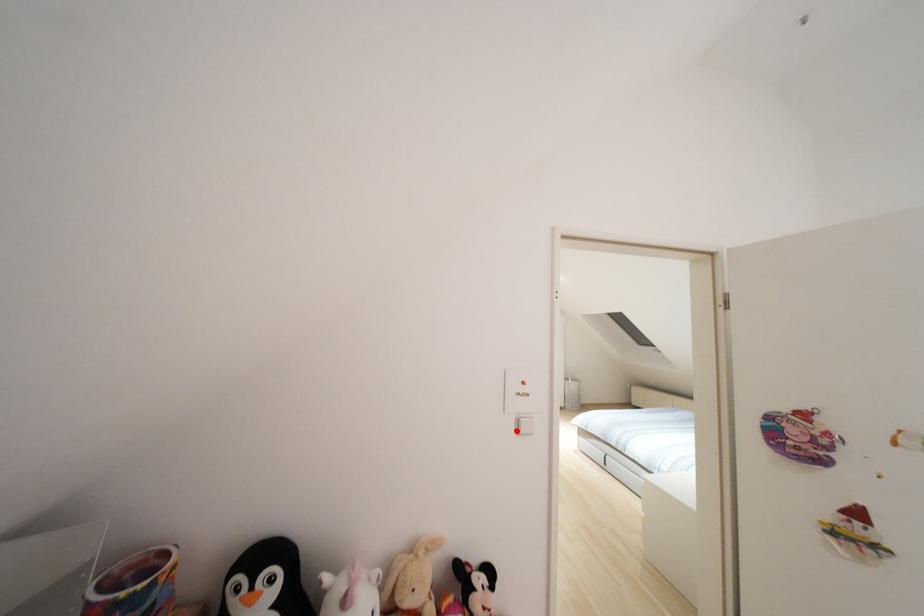
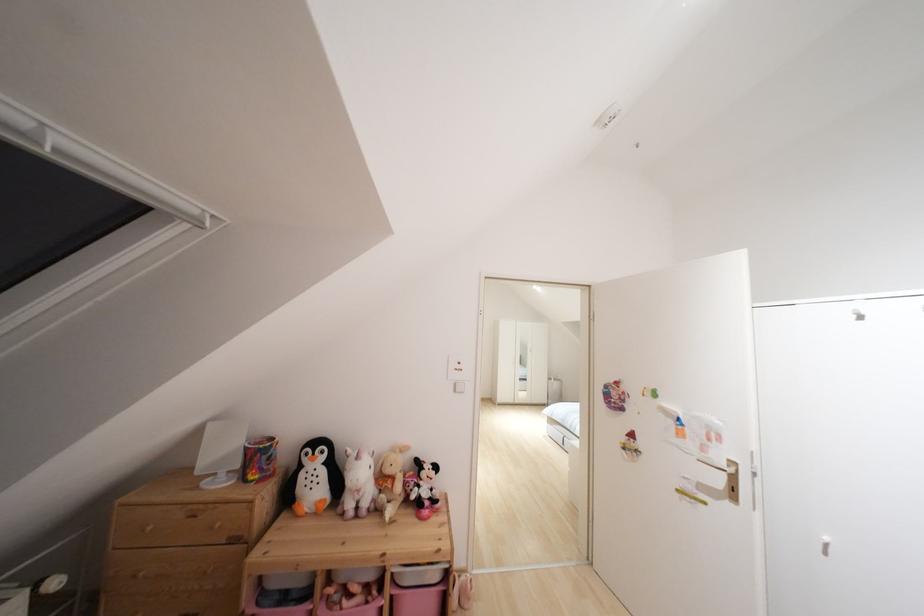
Locate, in the second image, the point that corresponds to the highlighted location in the first image.

(455, 390)